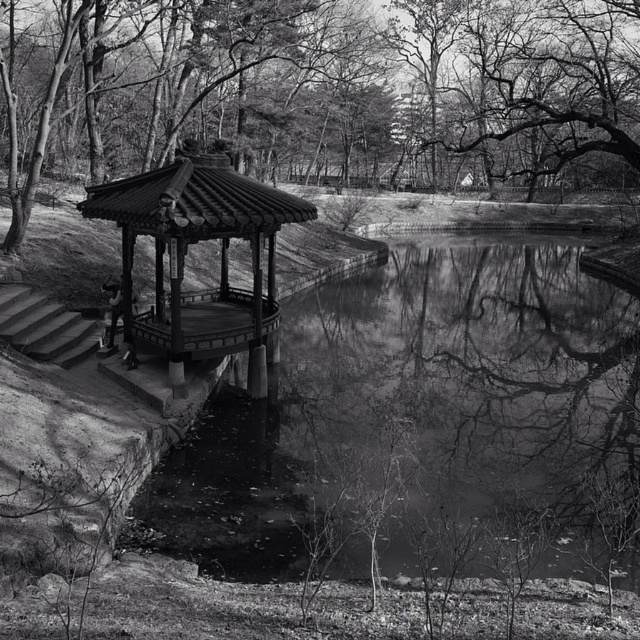
You are standing in the park and see the smooth bark tree at center and the wooden gazebo at center. Which one is closer to you?

The smooth bark tree at center is positioned over the wooden gazebo at center, so the smooth bark tree at center is closer to you.

You are standing at the point labeled as point (323, 88) in the image. Based on the scene description, what is the nearest object to you?

The nearest object to you is the smooth bark tree at center, as the point (323, 88) is located on it.